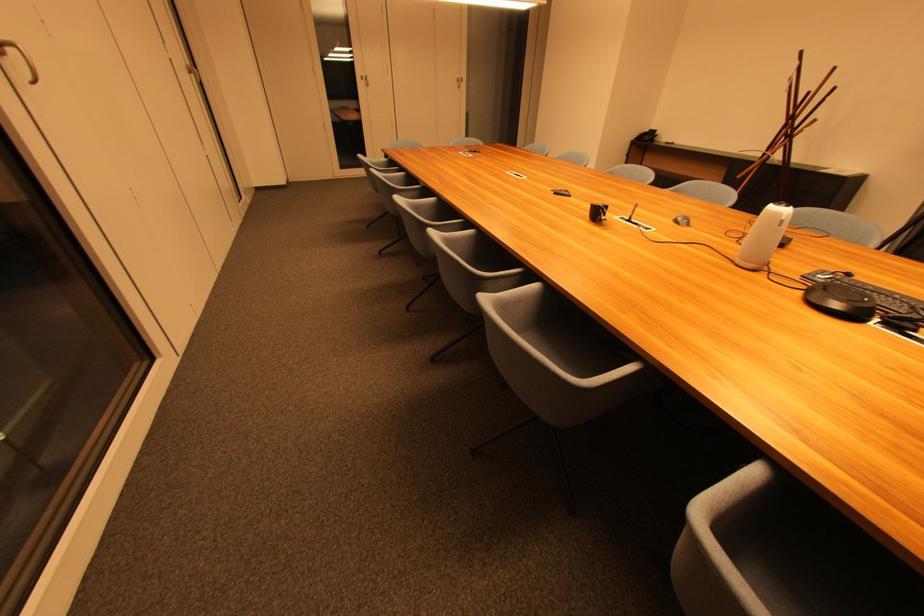
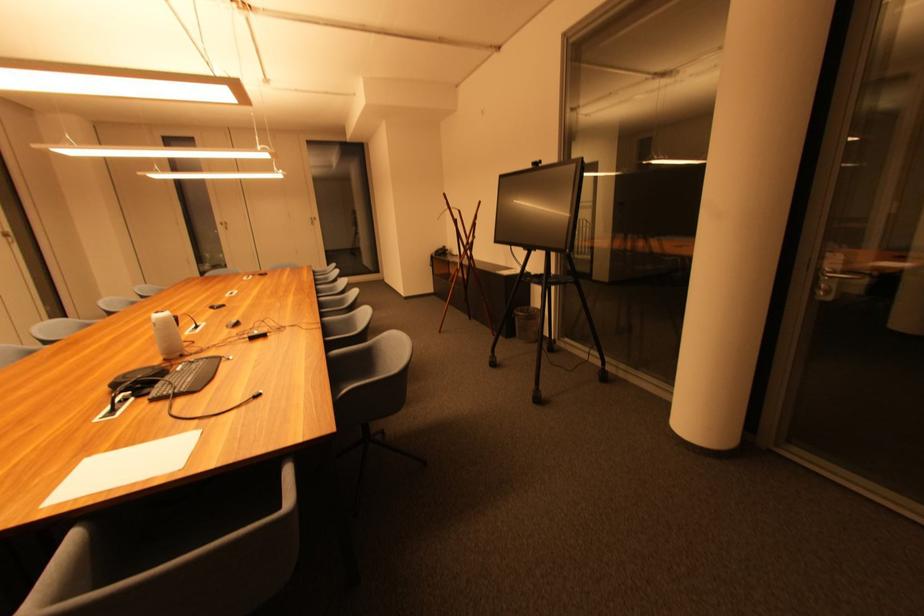
In the second image, find the point that corresponds to pixel 367 81 in the first image.

(226, 225)